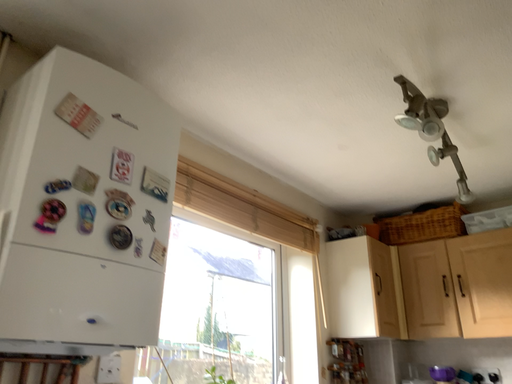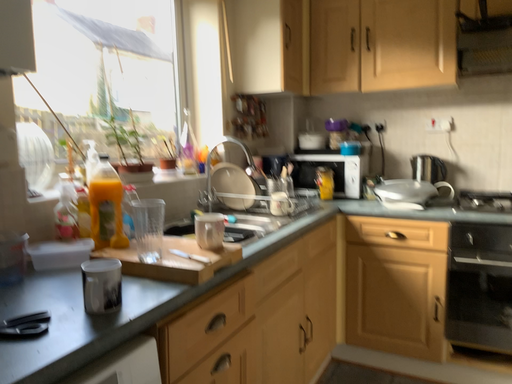
Question: How did the camera likely rotate when shooting the video?

Choices:
 (A) rotated downward
 (B) rotated upward

Answer: (A)